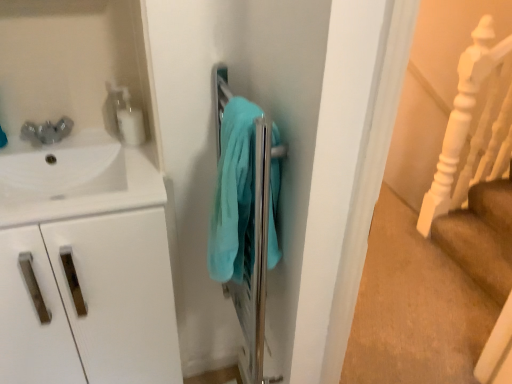
Question: Considering the relative sizes of white wooden stair rail at right and white glossy soap dispenser at upper left in the image provided, is white wooden stair rail at right bigger than white glossy soap dispenser at upper left?

Choices:
 (A) yes
 (B) no

Answer: (A)

Question: From a real-world perspective, is white wooden stair rail at right located higher than white glossy soap dispenser at upper left?

Choices:
 (A) yes
 (B) no

Answer: (B)

Question: Is white wooden stair rail at right positioned behind white glossy soap dispenser at upper left?

Choices:
 (A) yes
 (B) no

Answer: (A)

Question: Is white wooden stair rail at right at the right side of white glossy soap dispenser at upper left?

Choices:
 (A) yes
 (B) no

Answer: (A)

Question: Can you confirm if white wooden stair rail at right is thinner than white glossy soap dispenser at upper left?

Choices:
 (A) yes
 (B) no

Answer: (B)

Question: Is teal soft towel at center taller or shorter than white matte cabinet at left?

Choices:
 (A) short
 (B) tall

Answer: (A)

Question: Choose the correct answer: Is teal soft towel at center inside white matte cabinet at left or outside it?

Choices:
 (A) inside
 (B) outside

Answer: (B)

Question: Considering the positions of teal soft towel at center and white matte cabinet at left in the image, is teal soft towel at center wider or thinner than white matte cabinet at left?

Choices:
 (A) thin
 (B) wide

Answer: (A)

Question: In the image, is teal soft towel at center on the left side or the right side of white matte cabinet at left?

Choices:
 (A) right
 (B) left

Answer: (A)

Question: Considering their positions, is white glossy sink at upper left located in front of or behind white wooden stair rail at right?

Choices:
 (A) behind
 (B) front

Answer: (B)

Question: Would you say white glossy sink at upper left is to the left or to the right of white wooden stair rail at right in the picture?

Choices:
 (A) left
 (B) right

Answer: (A)

Question: From a real-world perspective, is white glossy sink at upper left physically located above or below white wooden stair rail at right?

Choices:
 (A) above
 (B) below

Answer: (A)

Question: In terms of height, does white glossy sink at upper left look taller or shorter compared to white wooden stair rail at right?

Choices:
 (A) short
 (B) tall

Answer: (A)

Question: From the image's perspective, is white glossy sink at upper left located above or below white glossy soap dispenser at upper left?

Choices:
 (A) below
 (B) above

Answer: (A)

Question: Relative to white glossy soap dispenser at upper left, is white glossy sink at upper left in front or behind?

Choices:
 (A) behind
 (B) front

Answer: (B)